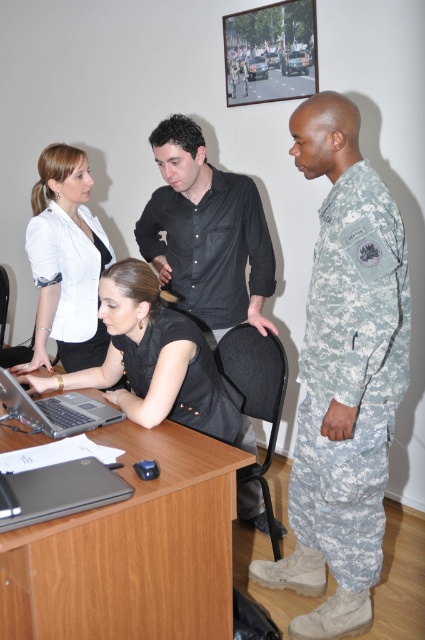
From the picture: You are a security guard assigned to monitor the room where the camouflage fabric uniform at right and the black matte shirt at center are located. From your vantage point, which object is positioned to the right of the other?

The camouflage fabric uniform at right is positioned to the right of the black matte shirt at center.

You are an interior designer assessing the space for a new desk. The black matte shirt at center and the black matte laptop at lower left are both in the way. Which object takes up more horizontal space?

The black matte shirt at center takes up more horizontal space than the black matte laptop at lower left because its width is larger.

You are an interior designer assessing the space for a new desk. You notice the black matte shirt at center and the black matte laptop at lower left. Which object takes up more space in the scene?

The black matte shirt at center takes up more space in the scene as it is bigger than the black matte laptop at lower left.